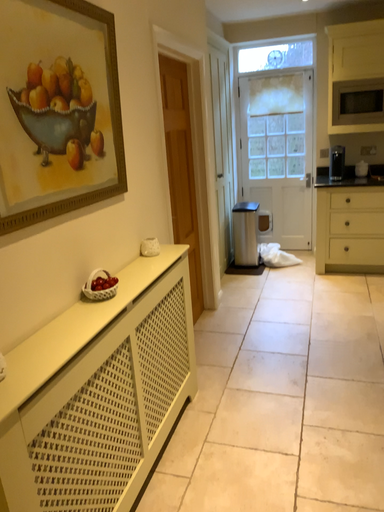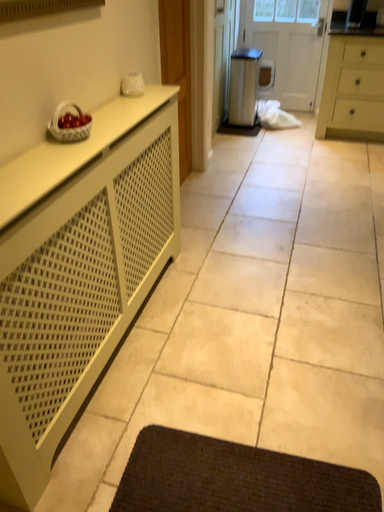
Question: Which way did the camera rotate in the video?

Choices:
 (A) rotated upward
 (B) rotated downward

Answer: (B)